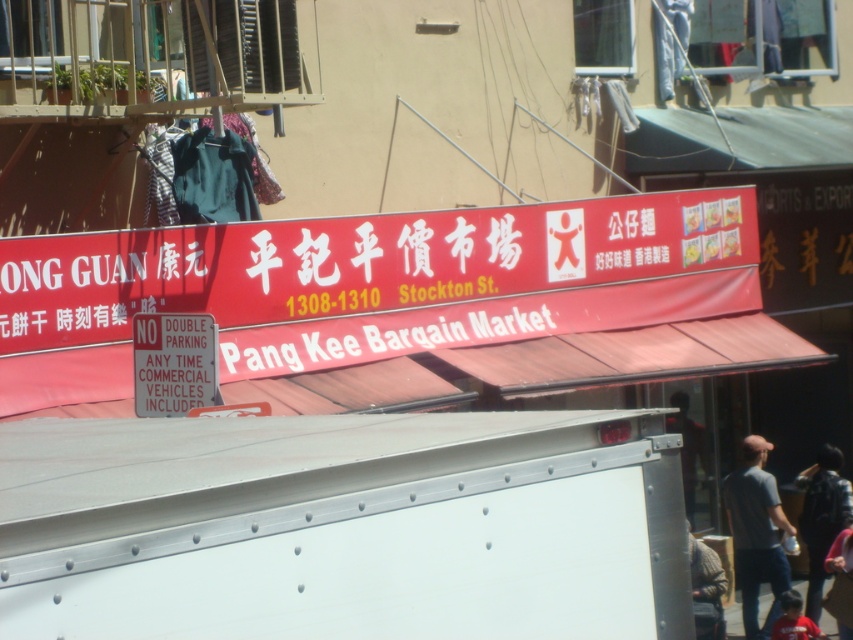
In the scene shown: You are a delivery person trying to load packages into the back of the white truck. You have two items to place there, the gray cotton shirt at lower right and the dark brown leather jacket at lower right. Which item should you place first if you want to maximize space efficiency?

The gray cotton shirt at lower right has a lesser width compared to the dark brown leather jacket at lower right. Therefore, placing the gray cotton shirt first allows for better space utilization by fitting smaller items first before larger ones.

You are standing in front of the Pang Kee Bargain Market storefront. There are two points marked on the image at coordinates point (206, 346) and point (836, 541). Which point is closer to you?

Point (206, 346) is closer to the camera than point (836, 541).

You are a delivery driver who needs to park your truck near the Pang Kee Bargain Market. The truck has a width of 2 meters. The sign says vehicles cannot double park. Is there enough space between the matte plastic sign at center and the dark red shirt at lower right for your truck to pass through without double parking?

The matte plastic sign at center might be wider than dark red shirt at lower right, so there might be enough space for the truck to pass through without double parking. However, since the exact width isn not provided, it is recommended to check the actual space before proceeding.